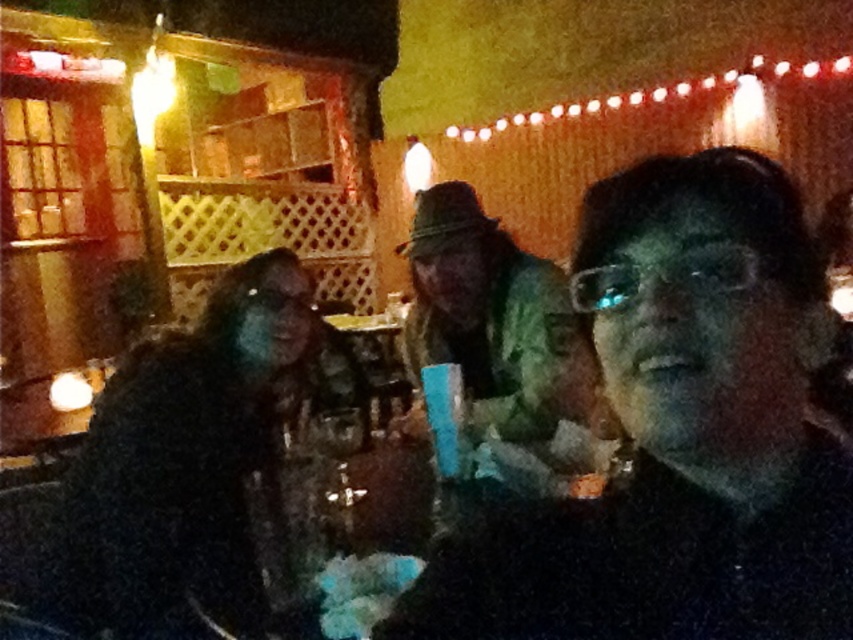
Which is in front, point (498, 577) or point (264, 429)?

Point (498, 577)

Between point (816, 266) and point (115, 518), which one is positioned behind?

Point (115, 518)

Measure the distance between point (x=616, y=612) and camera.

Point (x=616, y=612) and camera are 23.36 inches apart from each other.

Identify the location of matte black glasses at center. (677, 435).

Does matte black glasses at center appear on the right side of green camouflage jacket at center?

Incorrect, matte black glasses at center is not on the right side of green camouflage jacket at center.

Between matte black glasses at center and green camouflage jacket at center, which one is positioned lower?

matte black glasses at center is below.

What are the coordinates of `matte black glasses at center` in the screenshot? It's located at (677, 435).

The height and width of the screenshot is (640, 853). I want to click on matte black glasses at center, so click(x=677, y=435).

Which is below, black fuzzy coat at left or green camouflage jacket at center?

black fuzzy coat at left is lower down.

Identify the location of black fuzzy coat at left. The width and height of the screenshot is (853, 640). (186, 460).

This screenshot has width=853, height=640. In order to click on black fuzzy coat at left in this screenshot , I will do `click(186, 460)`.